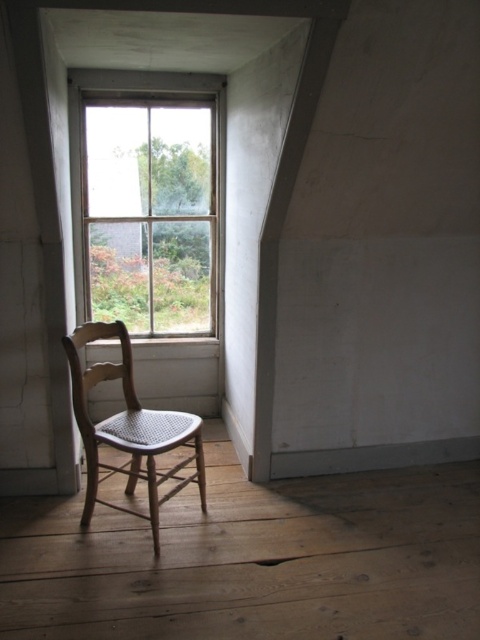
You are moving a 1.2 meter long wooden ladder into this room. The ladder must be placed between the clear glass window at center and the light wood cane chair at left. Is there enough space for the ladder to fit horizontally between them?

The clear glass window at center is 1.16 meters away from the light wood cane chair at left. Since the ladder is 1.2 meters long, it is slightly longer than the distance between them, so the ladder cannot fit horizontally between them.

You are standing in the room and want to sit down on the light wood cane chair at left. To do so, you must walk around the clear glass window at center. Which direction should you move relative to the window?

The clear glass window at center is positioned on the left side of the light wood cane chair at left. To reach the chair, you should move to the right side of the clear glass window at center.